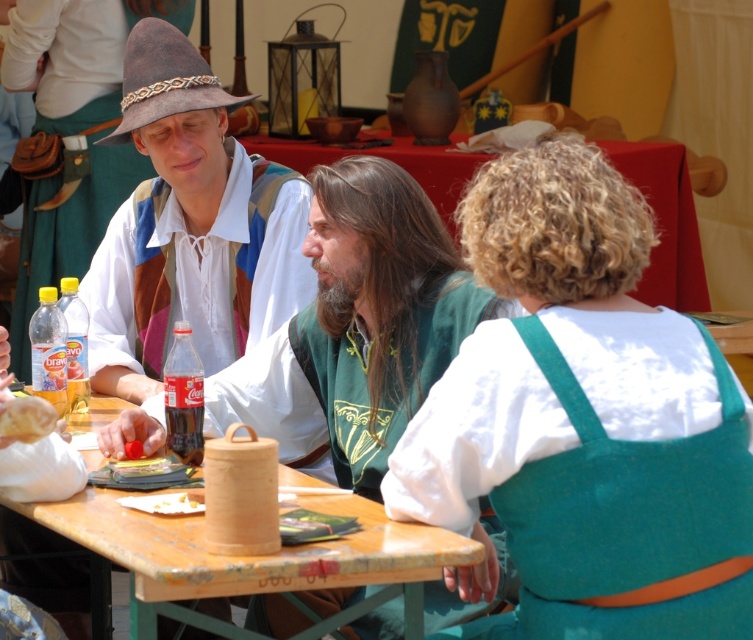
Does matte brown hat at upper left come in front of white paper napkin at table center?

No.

Measure the distance from matte brown hat at upper left to white paper napkin at table center.

A distance of 1.55 meters exists between matte brown hat at upper left and white paper napkin at table center.

Is point (294, 296) positioned behind point (177, 497)?

Yes, it is.

Where is `matte brown hat at upper left`? This screenshot has width=753, height=640. matte brown hat at upper left is located at coordinates (188, 227).

Where is `white cotton apron at center`? The height and width of the screenshot is (640, 753). white cotton apron at center is located at coordinates (72, 134).

Between white cotton apron at center and wooden at center, which one appears on the right side from the viewer's perspective?

wooden at center

I want to click on white cotton apron at center, so click(72, 134).

Based on the photo, does white cotton shirt at center come in front of white paper napkin at table center?

Yes, white cotton shirt at center is closer to the viewer.

Which of these two, white cotton shirt at center or white paper napkin at table center, stands taller?

white cotton shirt at center is taller.

Is point (666, 628) more distant than point (171, 513)?

That is False.

Identify the location of white cotton shirt at center. (584, 419).